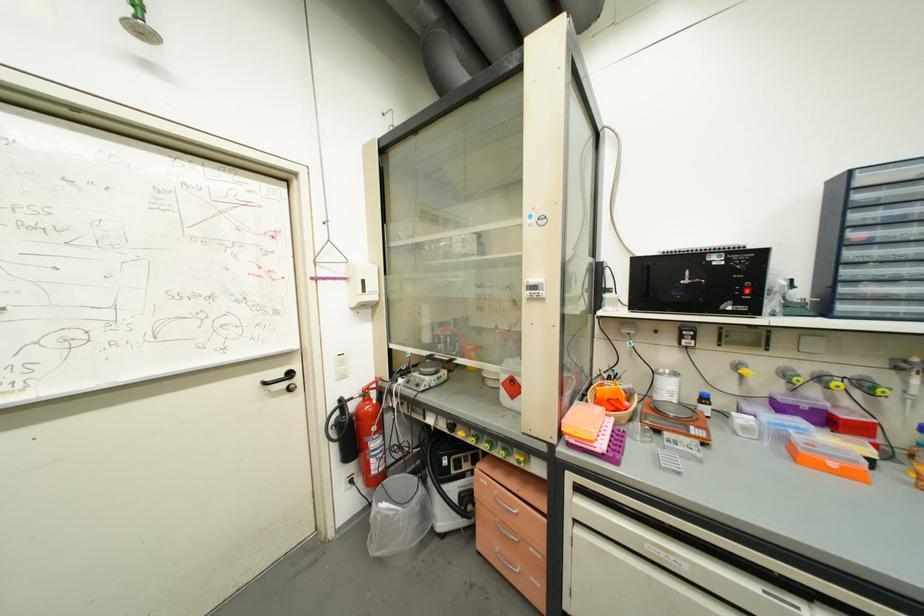
Where is `hot plate dial`? The height and width of the screenshot is (616, 924). hot plate dial is located at coordinates (699, 282).